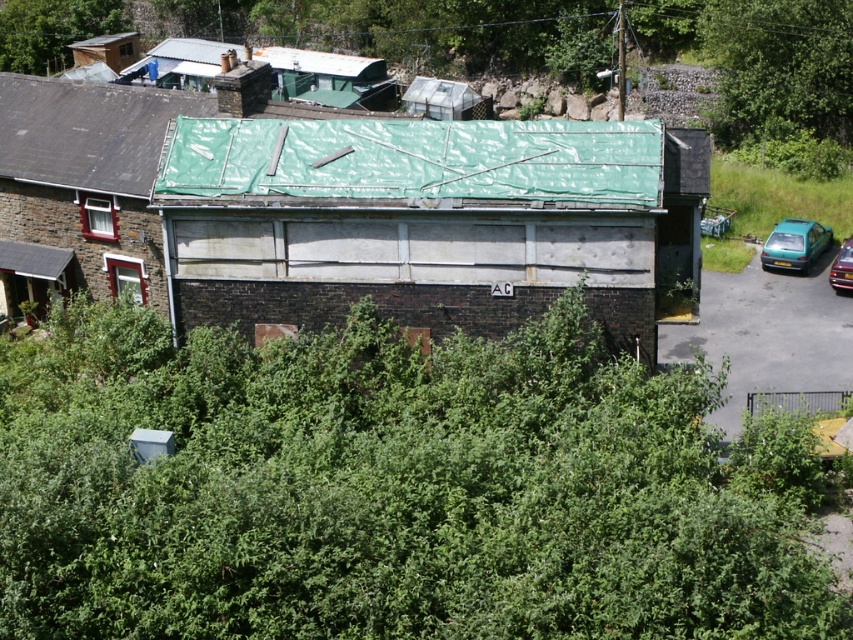
Question: Is green tarp at upper center above metallic green car at right?

Choices:
 (A) no
 (B) yes

Answer: (B)

Question: Estimate the real-world distances between objects in this image. Which object is farther from the metallic green car at right?

Choices:
 (A) green tarpaulin at center
 (B) green matte hatchback at right

Answer: (A)

Question: Is green tarpaulin at center bigger than green tarp at upper center?

Choices:
 (A) no
 (B) yes

Answer: (A)

Question: Which point is closer to the camera?

Choices:
 (A) (x=821, y=230)
 (B) (x=293, y=148)
 (C) (x=838, y=280)
 (D) (x=154, y=157)

Answer: (B)

Question: Does green tarpaulin at center have a greater width compared to green tarp at upper center?

Choices:
 (A) no
 (B) yes

Answer: (B)

Question: Considering the real-world distances, which object is closest to the metallic green car at right?

Choices:
 (A) green matte hatchback at right
 (B) green tarp at upper center

Answer: (A)